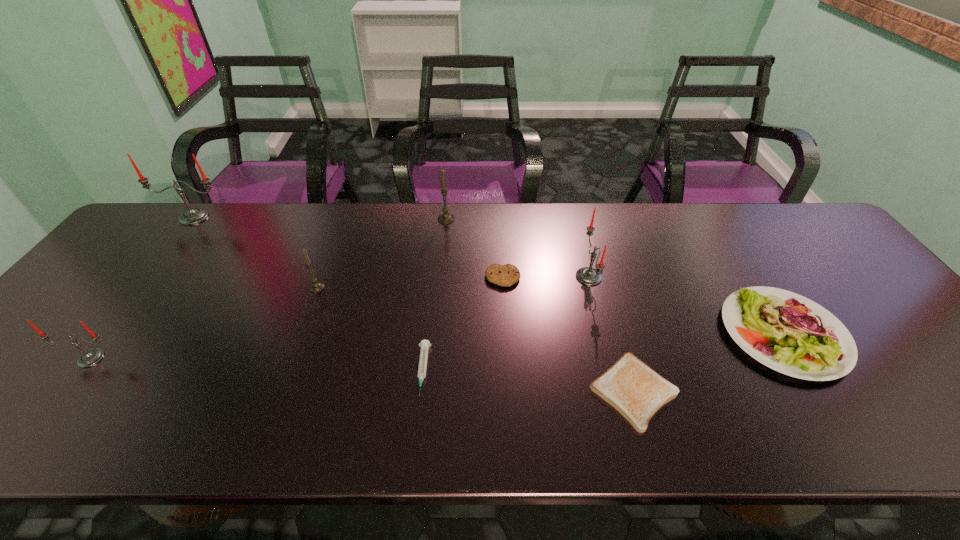
Locate an element on the screen. The width and height of the screenshot is (960, 540). vacant region located 0.200m on the front-facing side of the rightmost red candle is located at coordinates (503, 277).

Find the location of `vacant space located 0.130m on the front of the right gray candle`. vacant space located 0.130m on the front of the right gray candle is located at coordinates (444, 251).

Identify the location of vacant region located 0.390m on the front of the smaller gray candle. (263, 432).

The image size is (960, 540). What are the coordinates of `free region located on the front-facing side of the smallest red candle` in the screenshot? It's located at (25, 445).

Identify the location of free region located on the front of the green salad plate. The height and width of the screenshot is (540, 960). (829, 406).

Identify the location of vacant space located on the right of the sixth object from left to right. (593, 278).

The image size is (960, 540). In order to click on free spot located on the right of the shortest object in this screenshot , I will do `click(825, 391)`.

Locate an element on the screen. Image resolution: width=960 pixels, height=540 pixels. object situated at the near edge is located at coordinates (635, 390).

What are the coordinates of `object at the far left corner` in the screenshot? It's located at [192, 216].

The height and width of the screenshot is (540, 960). Find the location of `vacant region at the far edge of the desktop`. vacant region at the far edge of the desktop is located at coordinates (238, 246).